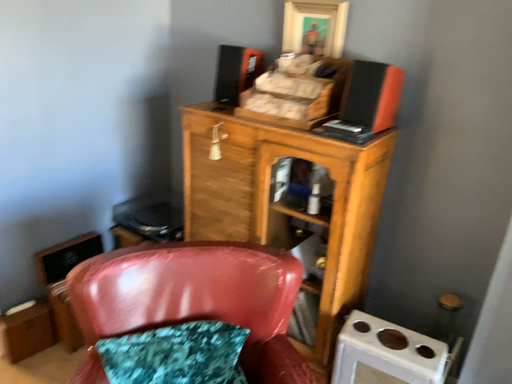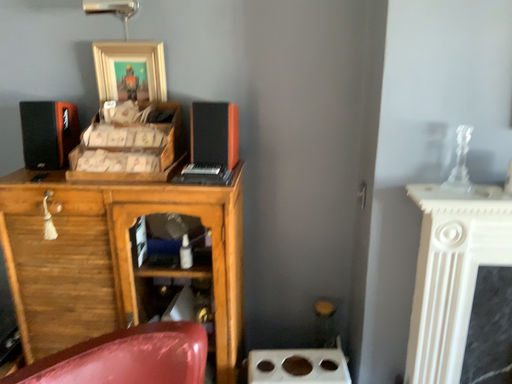
Question: How did the camera likely rotate when shooting the video?

Choices:
 (A) rotated right
 (B) rotated left

Answer: (A)